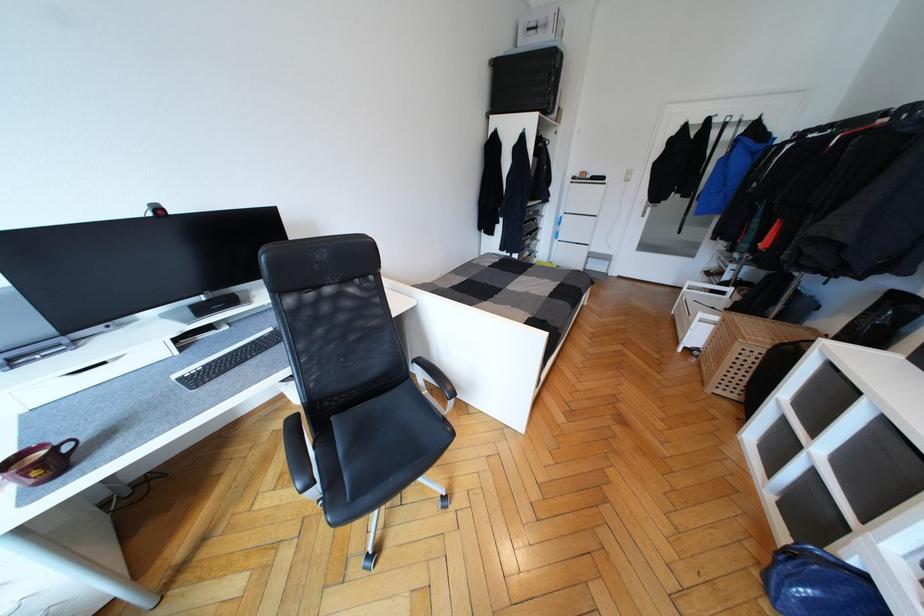
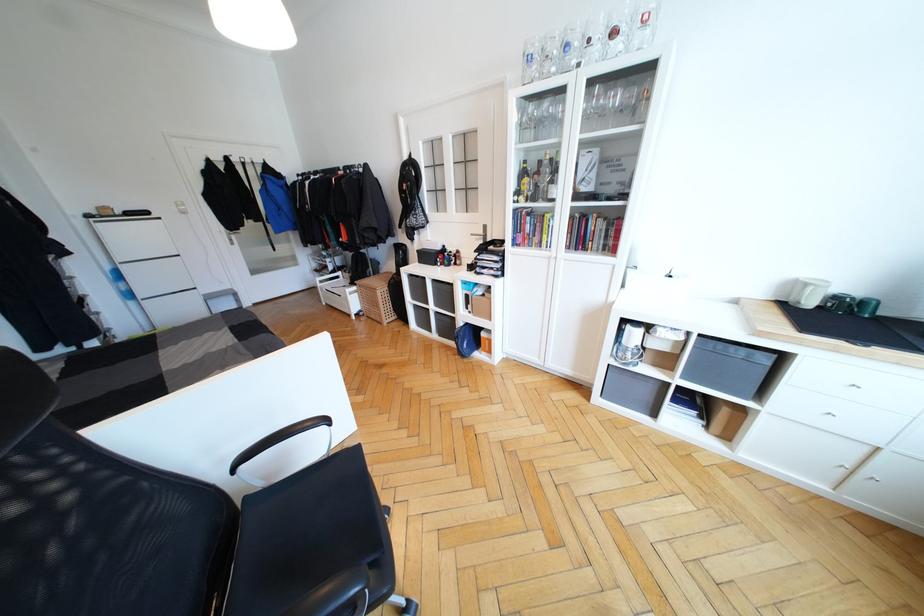
First-person continuous shooting, in which direction is the camera rotating?

The camera rotated toward right-down.